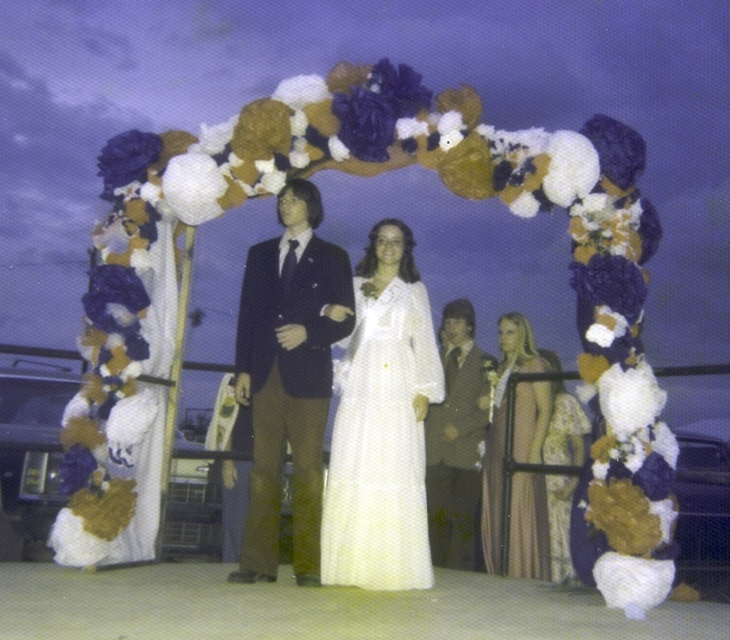
Is shiny dark blue suit at center bigger than white dotted fabric dress at center?

Yes, shiny dark blue suit at center is bigger than white dotted fabric dress at center.

Is shiny dark blue suit at center smaller than white dotted fabric dress at center?

Incorrect, shiny dark blue suit at center is not smaller in size than white dotted fabric dress at center.

What do you see at coordinates (288, 378) in the screenshot? I see `shiny dark blue suit at center` at bounding box center [288, 378].

The image size is (730, 640). I want to click on shiny dark blue suit at center, so click(x=288, y=378).

Who is positioned more to the right, white satin dress at center or shiny dark blue suit at center?

white satin dress at center

Locate an element on the screen. The image size is (730, 640). white satin dress at center is located at coordinates (380, 428).

Is white dotted fabric dress at center below silky gold dress at center?

No.

Who is more distant from viewer, (418, 326) or (557, 449)?

Positioned behind is point (557, 449).

Locate an element on the screen. The height and width of the screenshot is (640, 730). white dotted fabric dress at center is located at coordinates point(380,444).

What are the coordinates of `white dotted fabric dress at center` in the screenshot? It's located at (380, 444).